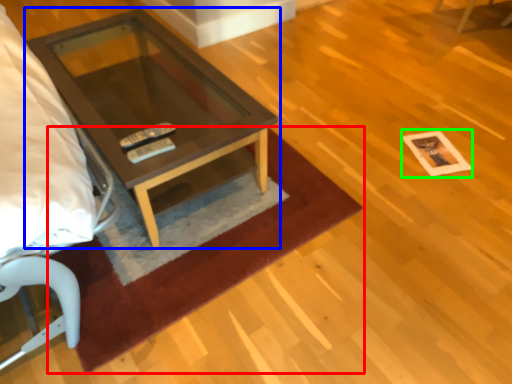
Question: Considering the real-world distances, which object is farthest from mat (highlighted by a red box)? coffee table (highlighted by a blue box) or square (highlighted by a green box)?

Choices:
 (A) coffee table
 (B) square

Answer: (B)